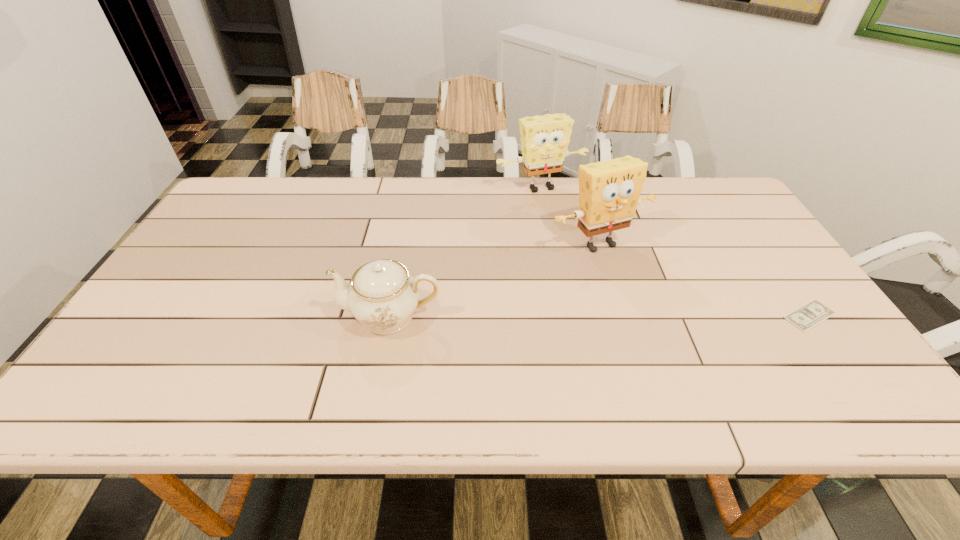
You are a GUI agent. You are given a task and a screenshot of the screen. Output one action in this format:
    pyautogui.click(x=<x>, y=<y>)
    Task: Click on the vacant space on the desktop that is between the leftmost object and the shortest object and is positioned on the face of the farther sponge
    The width and height of the screenshot is (960, 540).
    Given the screenshot: What is the action you would take?
    pyautogui.click(x=625, y=315)

Where is `free space on the desktop that is between the chinaware and the money and is positioned on the face of the third nearest object`? free space on the desktop that is between the chinaware and the money and is positioned on the face of the third nearest object is located at coordinates (662, 315).